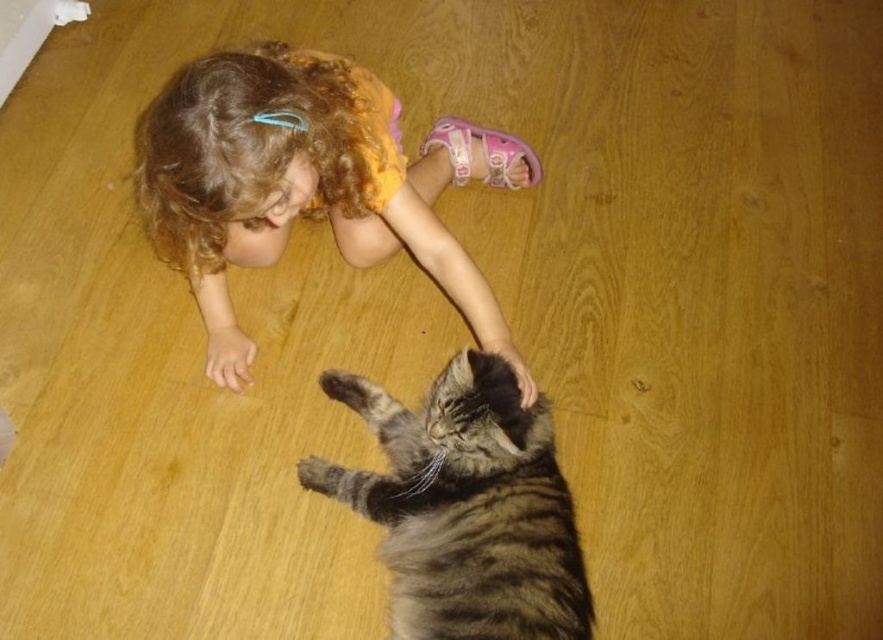
Can you confirm if curly blonde hair at upper left is taller than striped fur cat at lower center?

Yes.

This screenshot has width=883, height=640. What do you see at coordinates (306, 182) in the screenshot? I see `curly blonde hair at upper left` at bounding box center [306, 182].

Is point (180, 266) less distant than point (365, 401)?

No.

Where is `curly blonde hair at upper left`? curly blonde hair at upper left is located at coordinates click(x=306, y=182).